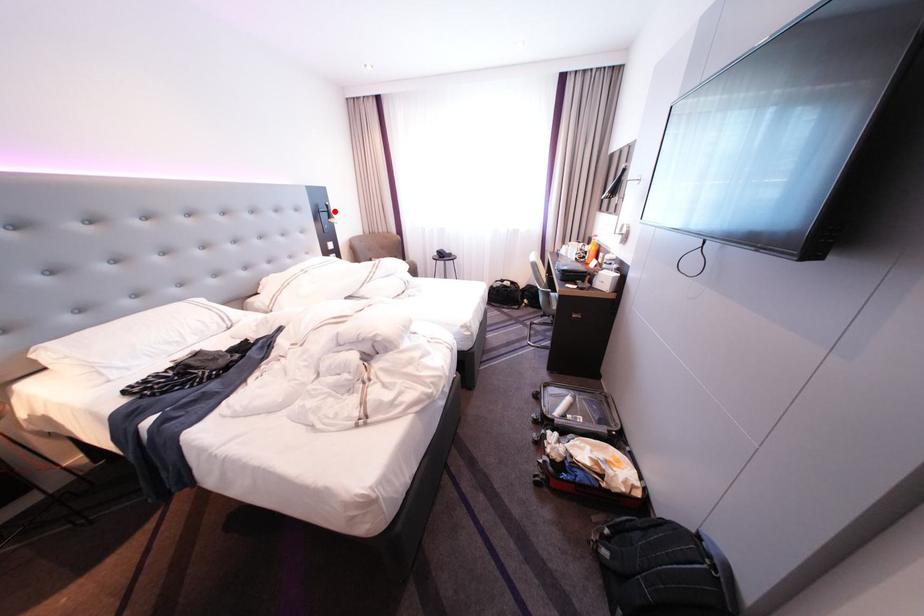
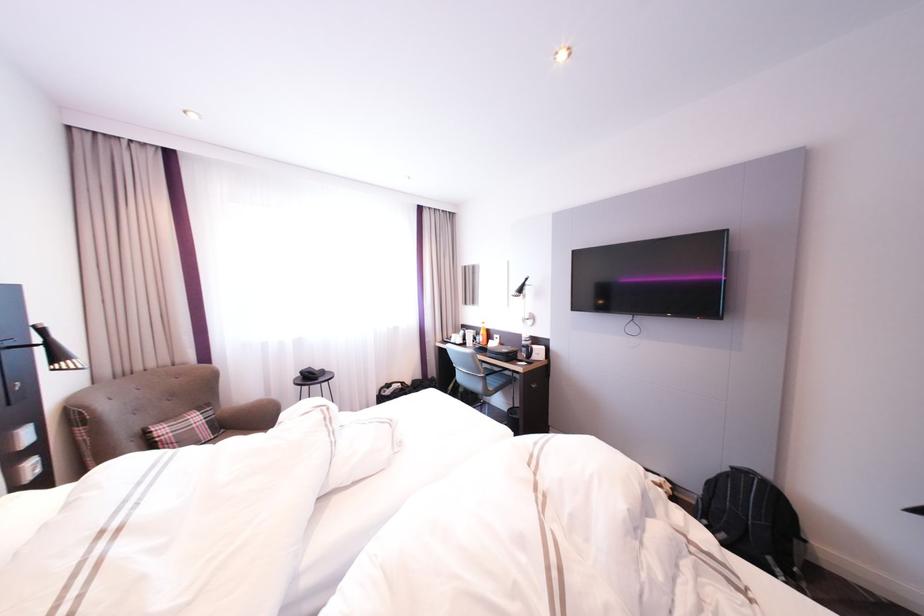
Locate, in the second image, the point that corresponds to the highlighted location in the first image.

(18, 345)